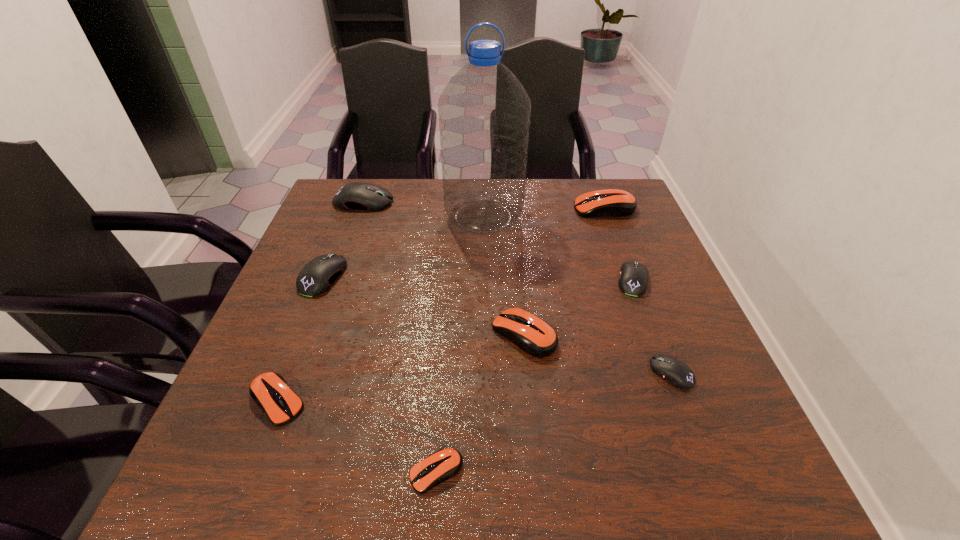
At what (x,y) coordinates should I click in order to perform the action: click on the tallest object. Please return your answer as a coordinate pair (x, y). The height and width of the screenshot is (540, 960). Looking at the image, I should click on (484, 111).

Identify the location of water jug. Image resolution: width=960 pixels, height=540 pixels. (484, 111).

You are a GUI agent. You are given a task and a screenshot of the screen. Output one action in this format:
    pyautogui.click(x=<x>, y=<y>)
    Task: Click on the farthest black computer equipment
    The image size is (960, 540).
    Given the screenshot: What is the action you would take?
    pyautogui.click(x=353, y=196)

Locate an element on the screen. the biggest orange computer mouse is located at coordinates click(x=611, y=202).

Where is `the farthest orange computer mouse`? This screenshot has height=540, width=960. the farthest orange computer mouse is located at coordinates (x=611, y=202).

This screenshot has width=960, height=540. I want to click on the third smallest black computer equipment, so click(318, 275).

Locate an element on the screen. This screenshot has height=540, width=960. the fourth computer mouse from right to left is located at coordinates (536, 337).

Find the location of `the second farthest orange computer mouse`. the second farthest orange computer mouse is located at coordinates (536, 337).

You are a GUI agent. You are given a task and a screenshot of the screen. Output one action in this format:
    pyautogui.click(x=<x>, y=<y>)
    Task: Click on the second smallest black computer equipment
    Image resolution: width=960 pixels, height=540 pixels.
    Given the screenshot: What is the action you would take?
    pyautogui.click(x=633, y=280)

Where is `the second smallest orange computer mouse`? The image size is (960, 540). the second smallest orange computer mouse is located at coordinates (270, 391).